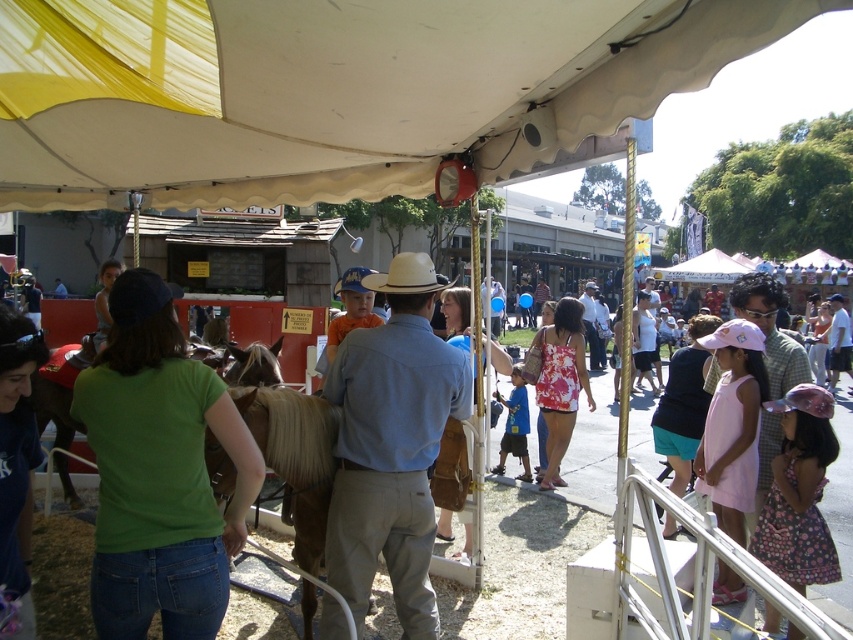
Is green cotton shirt at lower left to the left of white matte cowboy hat at center from the viewer's perspective?

Indeed, green cotton shirt at lower left is positioned on the left side of white matte cowboy hat at center.

Does green cotton shirt at lower left appear on the right side of white matte cowboy hat at center?

Incorrect, green cotton shirt at lower left is not on the right side of white matte cowboy hat at center.

Is point (171, 444) positioned after point (407, 280)?

No, (171, 444) is in front of (407, 280).

Image resolution: width=853 pixels, height=640 pixels. I want to click on green cotton shirt at lower left, so click(160, 472).

Is green cotton shirt at lower left thinner than light brown leather cowboy hat at center?

Incorrect, green cotton shirt at lower left's width is not less than light brown leather cowboy hat at center's.

The height and width of the screenshot is (640, 853). Describe the element at coordinates (160, 472) in the screenshot. I see `green cotton shirt at lower left` at that location.

Which is behind, point (136, 522) or point (758, 490)?

The point (758, 490) is more distant.

Find the location of a particular element. green cotton shirt at lower left is located at coordinates (160, 472).

Can you confirm if white fabric canopy at upper center is positioned above green cotton shirt at lower left?

Indeed, white fabric canopy at upper center is positioned over green cotton shirt at lower left.

Does white fabric canopy at upper center have a greater width compared to green cotton shirt at lower left?

Yes, white fabric canopy at upper center is wider than green cotton shirt at lower left.

Where is `white fabric canopy at upper center`? This screenshot has width=853, height=640. white fabric canopy at upper center is located at coordinates (335, 90).